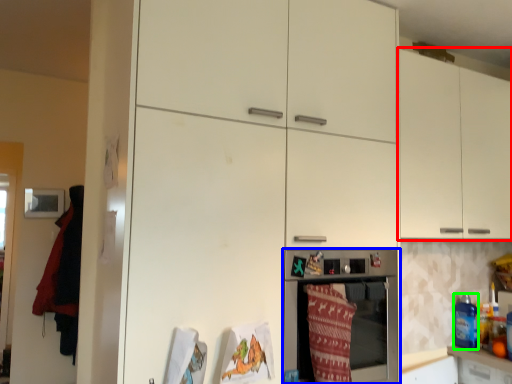
Question: Based on their relative distances, which object is nearer to cabinetry (highlighted by a red box)? Choose from home appliance (highlighted by a blue box) and beverage (highlighted by a green box).

Choices:
 (A) home appliance
 (B) beverage

Answer: (A)